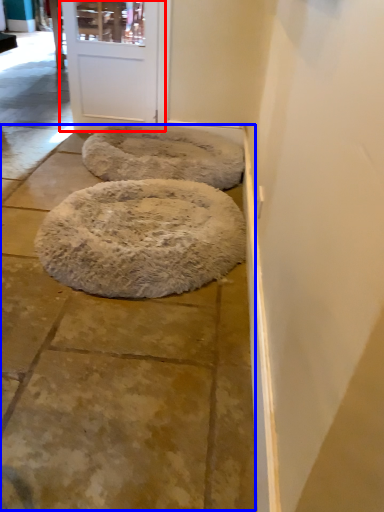
Question: Which object is closer to the camera taking this photo, door (highlighted by a red box) or pavement (highlighted by a blue box)?

Choices:
 (A) door
 (B) pavement

Answer: (B)